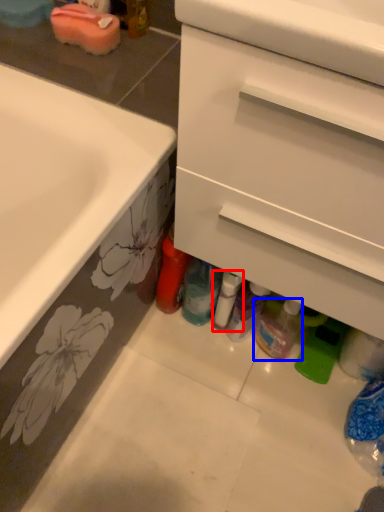
Question: Which object appears farthest to the camera in this image, bottle (highlighted by a red box) or bottle (highlighted by a blue box)?

Choices:
 (A) bottle
 (B) bottle

Answer: (A)